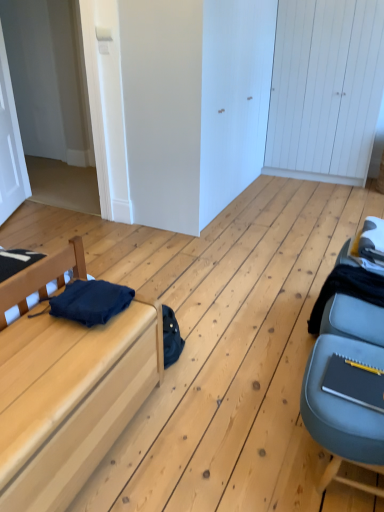
Locate an element on the screen. black fabric at right, which appears as the first clothing when viewed from the right is located at coordinates (347, 290).

Locate an element on the screen. This screenshot has height=512, width=384. matte wood bed at left is located at coordinates (70, 399).

You are a GUI agent. You are given a task and a screenshot of the screen. Output one action in this format:
    pyautogui.click(x=<x>, y=<y>)
    Task: Click on the dark blue fabric at left, the first clothing in the front-to-back sequence
    This screenshot has height=512, width=384.
    Given the screenshot: What is the action you would take?
    pyautogui.click(x=91, y=301)

The image size is (384, 512). Describe the element at coordinates (10, 145) in the screenshot. I see `white matte door at upper left, the first door in the left-to-right sequence` at that location.

Locate an element on the screen. This screenshot has height=512, width=384. white wooden door at upper right, positioned as the 2th door in left-to-right order is located at coordinates (325, 89).

This screenshot has height=512, width=384. I want to click on black fabric at right, which ranks as the second clothing in front-to-back order, so click(x=347, y=290).

Which is farther from the camera, [378,303] or [128,369]?

The point [378,303] is more distant.

Is black fabric at right, which appears as the first clothing when viewed from the right, at the left side of matte wood bed at left?

No, black fabric at right, which appears as the first clothing when viewed from the right, is not to the left of matte wood bed at left.

I want to click on clothing below the matte wood bed at left (from a real-world perspective), so click(347, 290).

From the image's perspective, is black fabric at right, which is the second clothing from left to right, below matte wood bed at left?

No.

Considering the relative sizes of matte wood bed at left and dark blue fabric at left, which is the 1th clothing from left to right, in the image provided, is matte wood bed at left thinner than dark blue fabric at left, which is the 1th clothing from left to right,?

In fact, matte wood bed at left might be wider than dark blue fabric at left, which is the 1th clothing from left to right.

Consider the image. From the image's perspective, is matte wood bed at left on dark blue fabric at left, the first clothing in the front-to-back sequence?

No, from the image's perspective, matte wood bed at left is not over dark blue fabric at left, the first clothing in the front-to-back sequence.

Between matte wood bed at left and dark blue fabric at left, which is the 1th clothing from left to right, which one has smaller size?

Smaller between the two is dark blue fabric at left, which is the 1th clothing from left to right.

In the scene shown: Which point is more distant from viewer, (58, 270) or (113, 303)?

The point (58, 270) is farther.

Is white matte door at upper left, which is the 2th door from back to front, looking in the opposite direction of dark blue fabric at left, the 2th clothing in the right-to-left sequence?

white matte door at upper left, which is the 2th door from back to front, does not have its back to dark blue fabric at left, the 2th clothing in the right-to-left sequence.

Is white matte door at upper left, the first door in the left-to-right sequence, situated inside dark blue fabric at left, which ranks as the second clothing in back-to-front order, or outside?

white matte door at upper left, the first door in the left-to-right sequence, cannot be found inside dark blue fabric at left, which ranks as the second clothing in back-to-front order.

Is white matte door at upper left, the 1th door when ordered from front to back, closer to the viewer compared to dark blue fabric at left, the first clothing in the front-to-back sequence?

No, white matte door at upper left, the 1th door when ordered from front to back, is further to the viewer.

Is matte wood bed at left not near white wooden door at upper right, the first door from the back?

Absolutely, matte wood bed at left is distant from white wooden door at upper right, the first door from the back.

Is matte wood bed at left bigger than white wooden door at upper right, which is counted as the first door, starting from the right?

Actually, matte wood bed at left might be smaller than white wooden door at upper right, which is counted as the first door, starting from the right.

This screenshot has height=512, width=384. I want to click on furniture below the white wooden door at upper right, positioned as the 2th door in left-to-right order (from a real-world perspective), so click(x=70, y=399).

Which object is further away from the camera taking this photo, white matte door at upper left, the 1th door when ordered from front to back, or matte wood bed at left?

white matte door at upper left, the 1th door when ordered from front to back, is more distant.

Can you confirm if white matte door at upper left, which is the 2th door from back to front, is positioned to the left of matte wood bed at left?

Indeed, white matte door at upper left, which is the 2th door from back to front, is positioned on the left side of matte wood bed at left.

From a real-world perspective, who is located lower, white matte door at upper left, the 1th door when ordered from front to back, or matte wood bed at left?

In real-world perspective, matte wood bed at left is lower.

From the image's perspective, who appears lower, white matte door at upper left, which is the 2th door from back to front, or matte wood bed at left?

matte wood bed at left, from the image's perspective.

Considering the sizes of black fabric at right, which is the first clothing from back to front, and white matte door at upper left, the 1th door when ordered from front to back, in the image, is black fabric at right, which is the first clothing from back to front, bigger or smaller than white matte door at upper left, the 1th door when ordered from front to back,?

In the image, black fabric at right, which is the first clothing from back to front, appears to be smaller than white matte door at upper left, the 1th door when ordered from front to back.

Does black fabric at right, which appears as the first clothing when viewed from the right, appear on the right side of white matte door at upper left, the first door in the left-to-right sequence?

Yes.

Who is more distant, black fabric at right, which appears as the first clothing when viewed from the right, or white matte door at upper left, the 2th door from the right?

white matte door at upper left, the 2th door from the right, is behind.

Is black fabric at right, which is the second clothing from left to right, positioned with its back to white matte door at upper left, which is the 2th door from back to front?

No, black fabric at right, which is the second clothing from left to right,'s orientation is not away from white matte door at upper left, which is the 2th door from back to front.

Does point (337, 282) come farther from viewer compared to point (369, 130)?

No.

Is white wooden door at upper right, positioned as the 2th door in left-to-right order, a part of black fabric at right, which appears as the first clothing when viewed from the right?

No, white wooden door at upper right, positioned as the 2th door in left-to-right order, is not surrounded by black fabric at right, which appears as the first clothing when viewed from the right.

Can you tell me how much black fabric at right, which ranks as the second clothing in front-to-back order, and white wooden door at upper right, the first door from the back, differ in facing direction?

The angle between the facing direction of black fabric at right, which ranks as the second clothing in front-to-back order, and the facing direction of white wooden door at upper right, the first door from the back, is 94.4 degrees.

From a real-world perspective, who is located lower, black fabric at right, which is the first clothing from back to front, or white wooden door at upper right, positioned as the 2th door in left-to-right order?

In real-world perspective, black fabric at right, which is the first clothing from back to front, is lower.

What are the coordinates of `clothing below the matte wood bed at left (from a real-world perspective)` in the screenshot? It's located at (347, 290).

The width and height of the screenshot is (384, 512). I want to click on clothing that is the 2nd one when counting upward from the matte wood bed at left (from the image's perspective), so click(91, 301).

Based on their spatial positions, is matte wood bed at left or white wooden door at upper right, the second door viewed from the front, further from white matte door at upper left, the first door in the left-to-right sequence?

white wooden door at upper right, the second door viewed from the front, lies further to white matte door at upper left, the first door in the left-to-right sequence, than the other object.

Looking at the image, which one is located further to dark blue fabric at left, the 2th clothing in the right-to-left sequence, white matte door at upper left, the first door in the left-to-right sequence, or white wooden door at upper right, positioned as the 2th door in left-to-right order?

white wooden door at upper right, positioned as the 2th door in left-to-right order, is positioned further to the anchor dark blue fabric at left, the 2th clothing in the right-to-left sequence.

Based on their spatial positions, is black fabric at right, which ranks as the second clothing in front-to-back order, or matte wood bed at left closer to white matte door at upper left, the 1th door when ordered from front to back?

Among the two, matte wood bed at left is located nearer to white matte door at upper left, the 1th door when ordered from front to back.

Consider the image. Considering their positions, is dark blue fabric at left, the first clothing in the front-to-back sequence, positioned further to white wooden door at upper right, positioned as the 2th door in left-to-right order, than white matte door at upper left, which is the 2th door from back to front?

The object further to white wooden door at upper right, positioned as the 2th door in left-to-right order, is dark blue fabric at left, the first clothing in the front-to-back sequence.

Based on their spatial positions, is dark blue fabric at left, which is the 1th clothing from left to right, or black fabric at right, which is the first clothing from back to front, closer to white wooden door at upper right, the second door viewed from the front?

Among the two, black fabric at right, which is the first clothing from back to front, is located nearer to white wooden door at upper right, the second door viewed from the front.

Which object lies further to the anchor point white wooden door at upper right, which is counted as the first door, starting from the right, black fabric at right, which is the first clothing from back to front, or matte wood bed at left?

Among the two, matte wood bed at left is located further to white wooden door at upper right, which is counted as the first door, starting from the right.

Based on their spatial positions, is matte wood bed at left or dark blue fabric at left, which is the 1th clothing from left to right, closer to white wooden door at upper right, the second door viewed from the front?

Based on the image, dark blue fabric at left, which is the 1th clothing from left to right, appears to be nearer to white wooden door at upper right, the second door viewed from the front.

Considering their positions, is white matte door at upper left, which is the 2th door from back to front, positioned closer to white wooden door at upper right, positioned as the 2th door in left-to-right order, than black fabric at right, which ranks as the second clothing in front-to-back order?

Among the two, black fabric at right, which ranks as the second clothing in front-to-back order, is located nearer to white wooden door at upper right, positioned as the 2th door in left-to-right order.

The image size is (384, 512). What are the coordinates of `furniture located between white matte door at upper left, which is the 2th door from back to front, and white wooden door at upper right, the first door from the back, in the left-right direction` in the screenshot? It's located at (70, 399).

Image resolution: width=384 pixels, height=512 pixels. Find the location of `clothing between matte wood bed at left and black fabric at right, which appears as the first clothing when viewed from the right, from left to right`. clothing between matte wood bed at left and black fabric at right, which appears as the first clothing when viewed from the right, from left to right is located at coordinates (91, 301).

Locate an element on the screen. furniture between white matte door at upper left, the first door in the left-to-right sequence, and black fabric at right, which is the first clothing from back to front, in the horizontal direction is located at coordinates (70, 399).

Find the location of `clothing between dark blue fabric at left, the 2th clothing in the right-to-left sequence, and white wooden door at upper right, which is counted as the first door, starting from the right, along the z-axis`. clothing between dark blue fabric at left, the 2th clothing in the right-to-left sequence, and white wooden door at upper right, which is counted as the first door, starting from the right, along the z-axis is located at coordinates (347, 290).